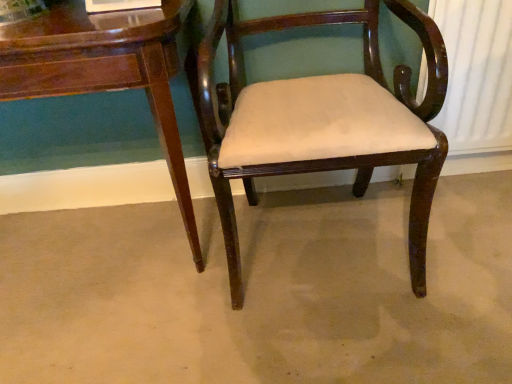
You are a GUI agent. You are given a task and a screenshot of the screen. Output one action in this format:
    pyautogui.click(x=<x>, y=<y>)
    Task: Click on the vacant area located to the right-hand side of mahogany wood chair at center
    This screenshot has height=384, width=512.
    Given the screenshot: What is the action you would take?
    pyautogui.click(x=449, y=228)